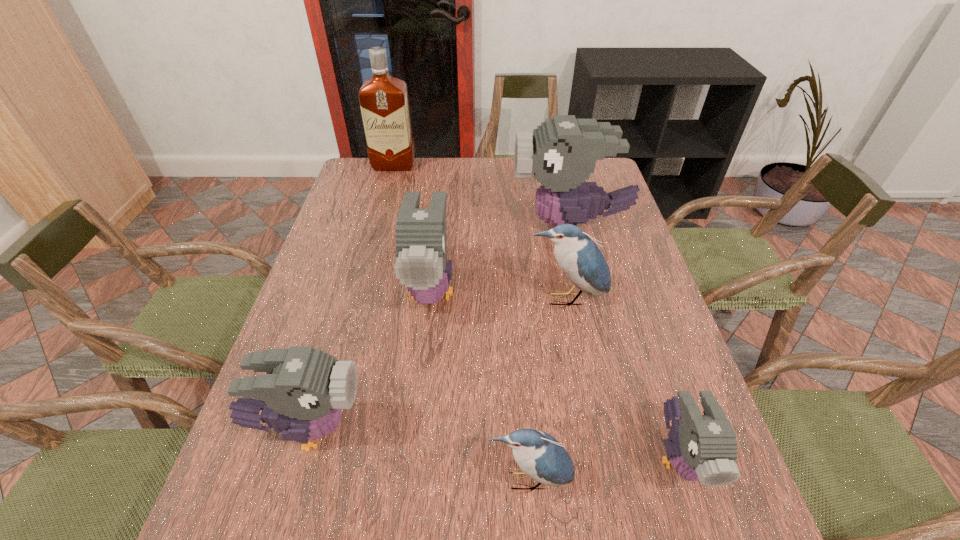
Locate an element on the screen. The image size is (960, 540). object at the far edge is located at coordinates (383, 99).

This screenshot has width=960, height=540. Find the location of `liquor present at the left edge`. liquor present at the left edge is located at coordinates pyautogui.click(x=383, y=99).

What are the coordinates of `bird positioned at the left edge` in the screenshot? It's located at (302, 395).

The height and width of the screenshot is (540, 960). Identify the location of object that is at the far left corner. (383, 99).

In the image, there is a desktop. At what (x,y) coordinates should I click in order to perform the action: click on blank space at the far edge. Please return your answer as a coordinate pair (x, y). Looking at the image, I should click on (455, 160).

You are a GUI agent. You are given a task and a screenshot of the screen. Output one action in this format:
    pyautogui.click(x=<x>, y=<y>)
    Task: Click on the vacant region at the left edge
    
    Given the screenshot: What is the action you would take?
    pyautogui.click(x=365, y=255)

This screenshot has width=960, height=540. I want to click on vacant space at the right edge of the desktop, so 631,236.

You are a GUI agent. You are given a task and a screenshot of the screen. Output one action in this format:
    pyautogui.click(x=<x>, y=<y>)
    Task: Click on the vacant space at the far right corner of the desktop
    Image resolution: width=960 pixels, height=540 pixels.
    Given the screenshot: What is the action you would take?
    pyautogui.click(x=605, y=161)

At what (x,y) coordinates should I click in order to perform the action: click on free space between the smallest gray bird and the nearer blue bird. Please return your answer as a coordinate pair (x, y). The image size is (960, 540). Looking at the image, I should click on (604, 469).

You are a GUI agent. You are given a task and a screenshot of the screen. Output one action in this format:
    pyautogui.click(x=<x>, y=<y>)
    Task: Click on the blank region between the second bird from left to right and the tallest bird
    The height and width of the screenshot is (540, 960).
    Given the screenshot: What is the action you would take?
    pyautogui.click(x=501, y=259)